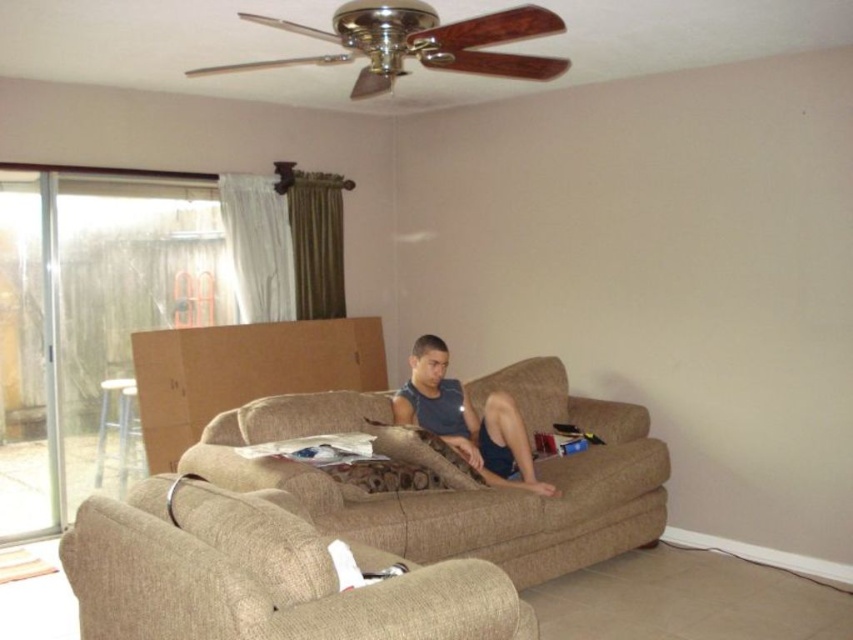
You are standing in the living room and want to place a small plant pot between the beige fabric couch at center and the matte blue tank top at center. According to the scene description, which object should the plant pot be closer to?

The beige fabric couch at center is to the left of the matte blue tank top at center, so the plant pot should be placed closer to the beige fabric couch at center to be between them.

You are trying to decide between sitting on the beige fabric couch at center or the beige fabric armchair at lower left. Which one has more space for your legs?

The beige fabric couch at center might be wider than beige fabric armchair at lower left, so it likely has more space for your legs.

You are planning to place a tall floor lamp in the living room. Based on the scene, which object between the beige fabric couch at center and the beige fabric armchair at lower left would you choose to place the lamp next to, considering their heights?

The beige fabric couch at center has a greater height compared to the beige fabric armchair at lower left. Therefore, placing the tall floor lamp next to the beige fabric couch at center would be more appropriate as it can provide a proportional balance in height.